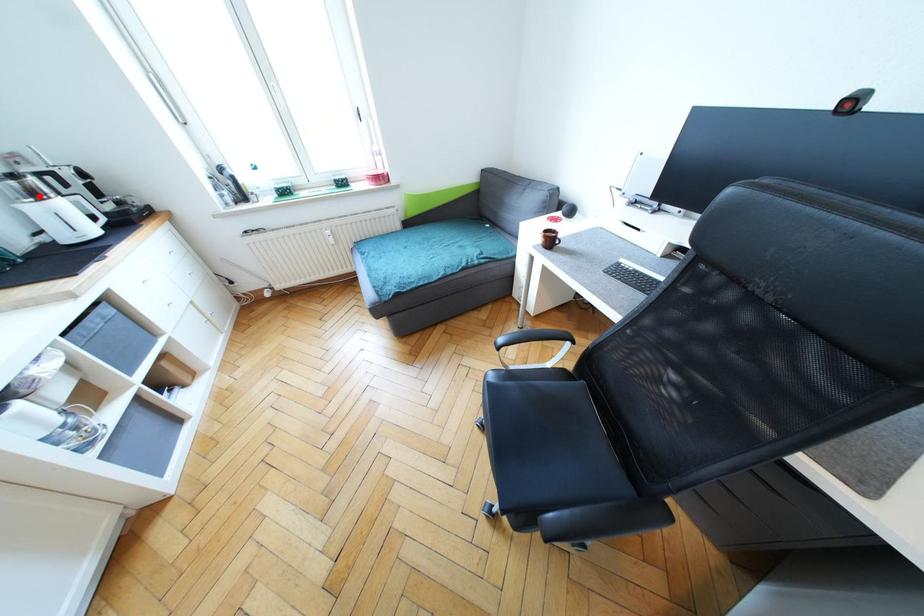
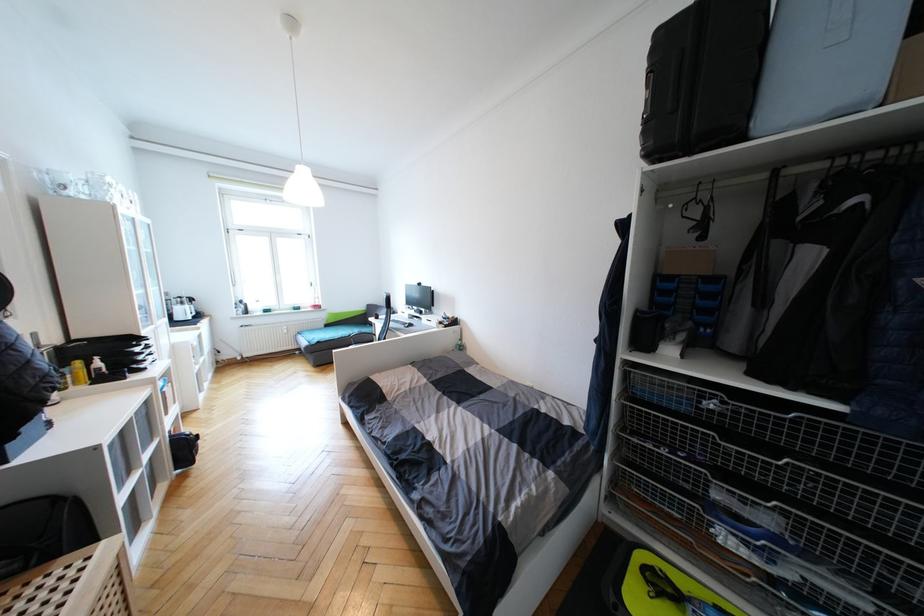
The point at the highlighted location is marked in the first image. Where is the corresponding point in the second image?

(186, 305)